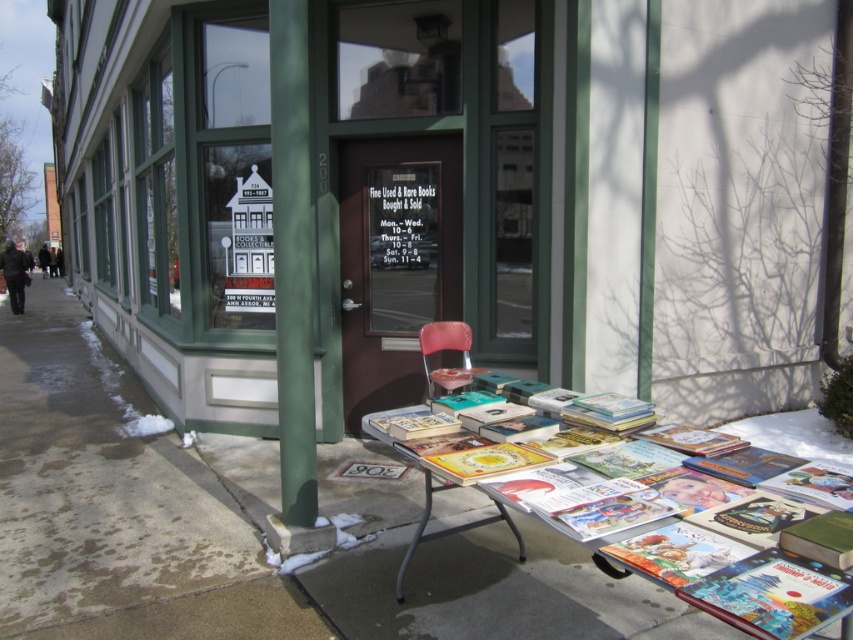
Can you confirm if wooden door at center is smaller than smooth concrete pavement at lower center?

Actually, wooden door at center might be larger than smooth concrete pavement at lower center.

Describe the element at coordinates (299, 188) in the screenshot. This screenshot has height=640, width=853. I see `wooden door at center` at that location.

What do you see at coordinates (299, 188) in the screenshot? Image resolution: width=853 pixels, height=640 pixels. I see `wooden door at center` at bounding box center [299, 188].

Where is `wooden door at center`? The height and width of the screenshot is (640, 853). wooden door at center is located at coordinates (299, 188).

The width and height of the screenshot is (853, 640). What are the coordinates of `smooth concrete pavement at lower center` in the screenshot? It's located at (247, 528).

Between smooth concrete pavement at lower center and green matte pole at center, which one appears on the left side from the viewer's perspective?

smooth concrete pavement at lower center

Is point (164, 461) positioned in front of point (283, 72)?

No, it is not.

You are a GUI agent. You are given a task and a screenshot of the screen. Output one action in this format:
    pyautogui.click(x=<x>, y=<y>)
    Task: Click on the smooth concrete pavement at lower center
    
    Given the screenshot: What is the action you would take?
    pyautogui.click(x=247, y=528)

Which is more to the left, pink plastic chair at center or metallic silver table at lower center?

metallic silver table at lower center

Can you confirm if pink plastic chair at center is wider than metallic silver table at lower center?

Correct, the width of pink plastic chair at center exceeds that of metallic silver table at lower center.

Locate an element on the screen. pink plastic chair at center is located at coordinates (445, 349).